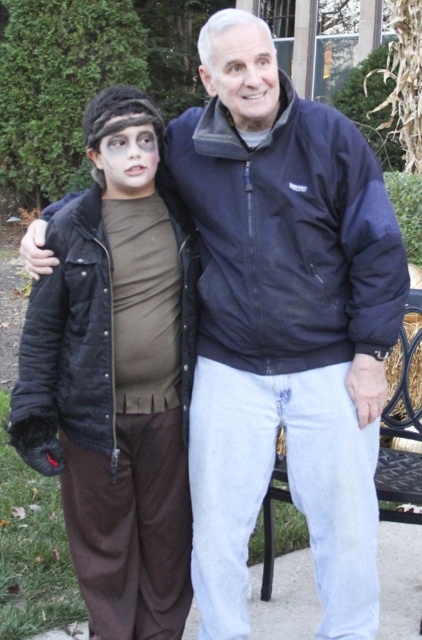
Can you confirm if matte black jacket at left is thinner than metallic black bench at lower right?

No, matte black jacket at left is not thinner than metallic black bench at lower right.

Is point (124, 540) closer to viewer compared to point (416, 342)?

Yes, it is.

Does point (151, 172) come in front of point (418, 417)?

Yes, point (151, 172) is closer to viewer.

At what (x,y) coordinates should I click in order to perform the action: click on matte black jacket at left. Please return your answer as a coordinate pair (x, y). Looking at the image, I should click on (116, 378).